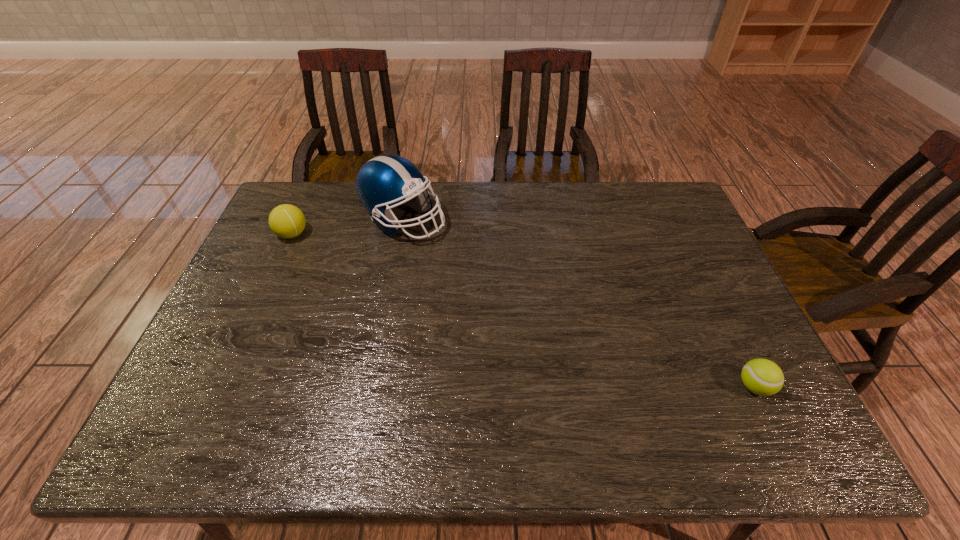
The height and width of the screenshot is (540, 960). In order to click on empty location between the shorter tennis ball and the tallest object in this screenshot , I will do `click(579, 303)`.

Locate an element on the screen. unoccupied position between the football helmet and the second tallest object is located at coordinates [348, 227].

This screenshot has width=960, height=540. What are the coordinates of `vacant area that lies between the second shortest object and the football helmet` in the screenshot? It's located at (348, 227).

I want to click on vacant space that is in between the taller tennis ball and the shortest object, so click(x=523, y=310).

Find the location of `unoccupied area between the shortest object and the left tennis ball`. unoccupied area between the shortest object and the left tennis ball is located at coordinates (523, 310).

The image size is (960, 540). I want to click on vacant space that is in between the football helmet and the shorter tennis ball, so click(579, 303).

You are a GUI agent. You are given a task and a screenshot of the screen. Output one action in this format:
    pyautogui.click(x=<x>, y=<y>)
    Task: Click on the vacant area that lies between the second tallest object and the second object from right to left
    
    Given the screenshot: What is the action you would take?
    pyautogui.click(x=348, y=227)

Where is `unoccupied area between the right tennis ball and the football helmet`? This screenshot has width=960, height=540. unoccupied area between the right tennis ball and the football helmet is located at coordinates (579, 303).

Find the location of `object that ranks as the closest to the tallest object`. object that ranks as the closest to the tallest object is located at coordinates (287, 221).

Select which object appears as the second closest to the second object from right to left. Please provide its 2D coordinates. Your answer should be formatted as a tuple, i.e. [(x, y)], where the tuple contains the x and y coordinates of a point satisfying the conditions above.

[(763, 377)]